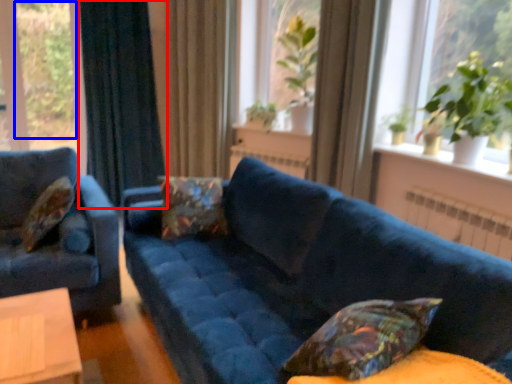
Question: Which point is closer to the camera, curtain (highlighted by a red box) or plant (highlighted by a blue box)?

Choices:
 (A) curtain
 (B) plant

Answer: (A)